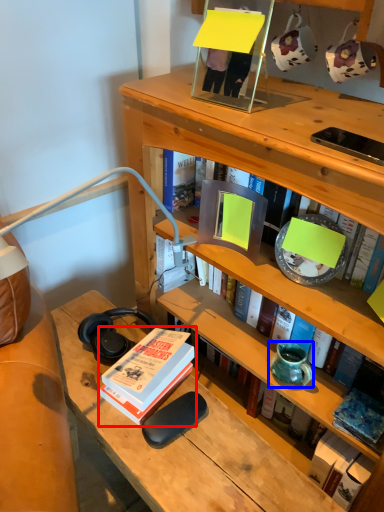
Question: Which object appears farthest to the camera in this image, book (highlighted by a red box) or vase (highlighted by a blue box)?

Choices:
 (A) book
 (B) vase

Answer: (B)